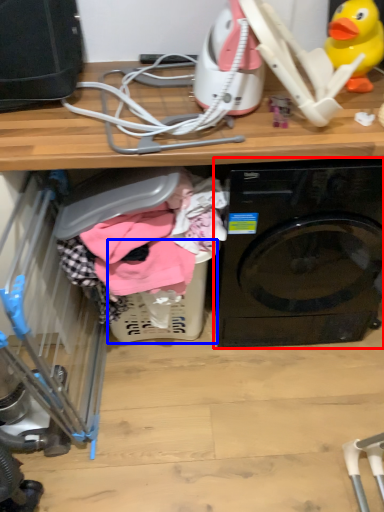
Question: Which point is closer to the camera, washing machine (highlighted by a red box) or basket (highlighted by a blue box)?

Choices:
 (A) washing machine
 (B) basket

Answer: (A)